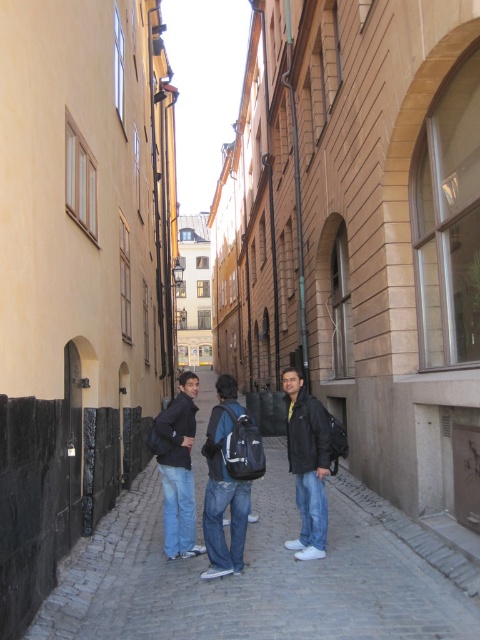
Question: Can you confirm if dark blue jeans at center is positioned below black matte jacket at center?

Choices:
 (A) no
 (B) yes

Answer: (B)

Question: Is dark blue jeans at center thinner than black matte jacket at center?

Choices:
 (A) no
 (B) yes

Answer: (A)

Question: Is dark blue jeans at center to the left of black matte jacket at center from the viewer's perspective?

Choices:
 (A) no
 (B) yes

Answer: (B)

Question: Which of the following is the farthest from the observer?

Choices:
 (A) jeans at center
 (B) gray cobblestone pavement at lower center
 (C) black matte jacket at center

Answer: (A)

Question: Which object is closer to the camera taking this photo?

Choices:
 (A) dark blue jeans at center
 (B) jeans at center
 (C) gray cobblestone pavement at lower center

Answer: (C)

Question: Which point is farther to the camera?

Choices:
 (A) dark blue jeans at center
 (B) jeans at center
 (C) black matte jacket at center

Answer: (B)